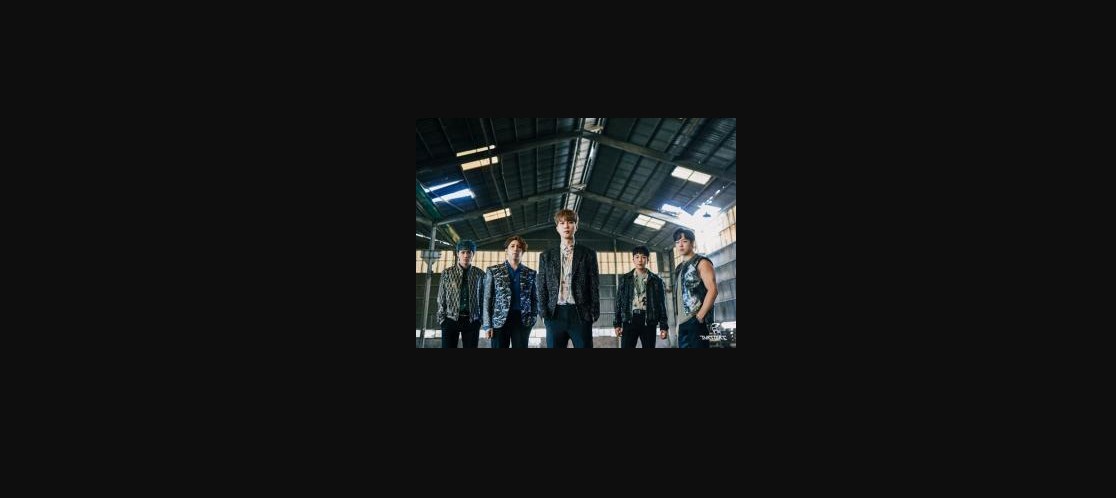
What are the coordinates of `ceiling` in the screenshot? It's located at (538, 161).